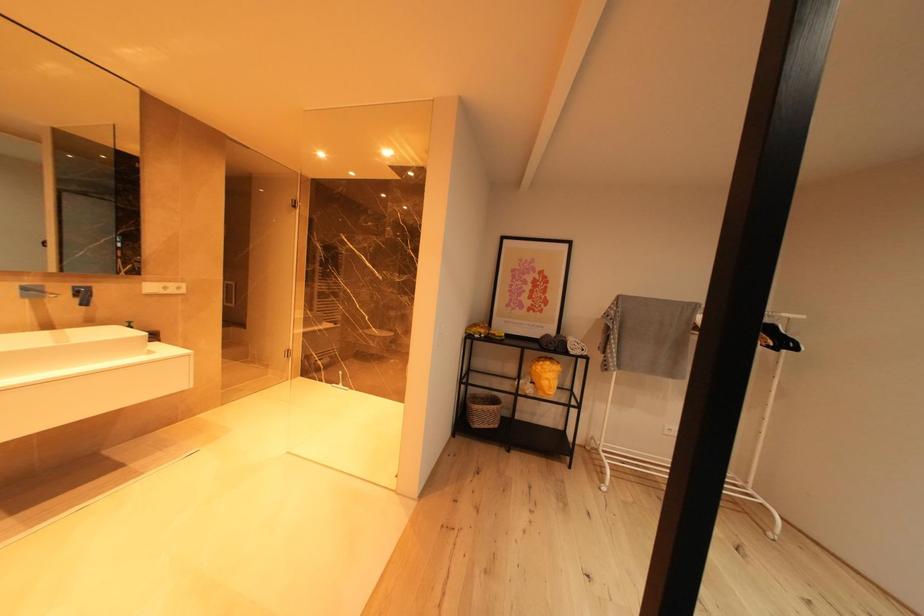
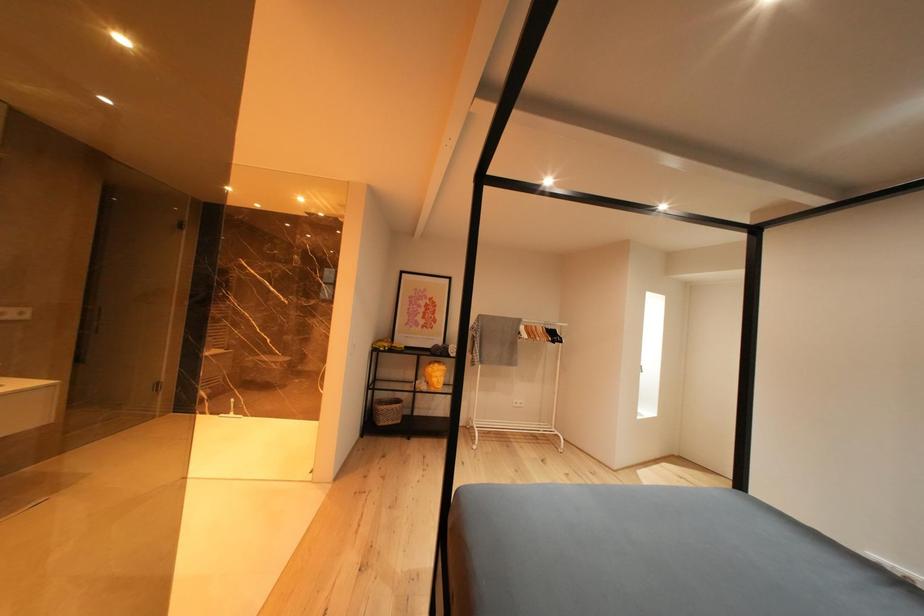
Question: The camera is either moving clockwise (left) or counter-clockwise (right) around the object. The first image is from the beginning of the video and the second image is from the end. Is the camera moving left or right when shooting the video?

Choices:
 (A) Left
 (B) Right

Answer: (A)